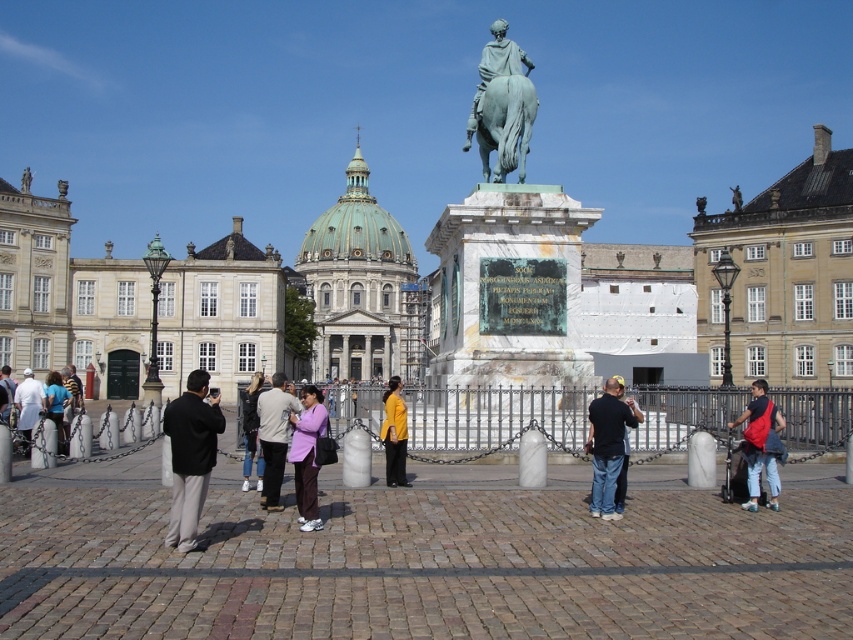
Question: Does green marble dome at center appear on the left side of polished bronze statue at center?

Choices:
 (A) yes
 (B) no

Answer: (A)

Question: Is dark gray pants at center smaller than matte purple jacket at center?

Choices:
 (A) yes
 (B) no

Answer: (B)

Question: Does green polished marble statue at center appear on the right side of light purple fabric shirt at center?

Choices:
 (A) no
 (B) yes

Answer: (B)

Question: Which object is farther from the camera taking this photo?

Choices:
 (A) matte purple shirt at center
 (B) matte purple jacket at center

Answer: (B)

Question: Which object appears closest to the camera in this image?

Choices:
 (A) light purple fabric shirt at center
 (B) matte purple jacket at center
 (C) purple fabric pants at center

Answer: (C)

Question: Estimate the real-world distances between objects in this image. Which object is closer to the matte purple jacket at center?

Choices:
 (A) green polished marble statue at center
 (B) polished bronze statue at center
 (C) light purple fabric shirt at center

Answer: (C)